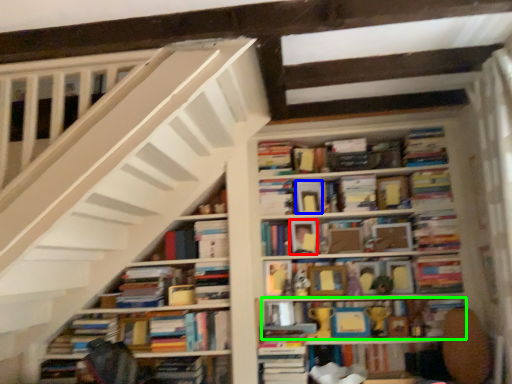
Question: Based on their relative distances, which object is farther from paperback book (highlighted by a red box)? Choose from paperback book (highlighted by a blue box) and book (highlighted by a green box).

Choices:
 (A) paperback book
 (B) book

Answer: (B)